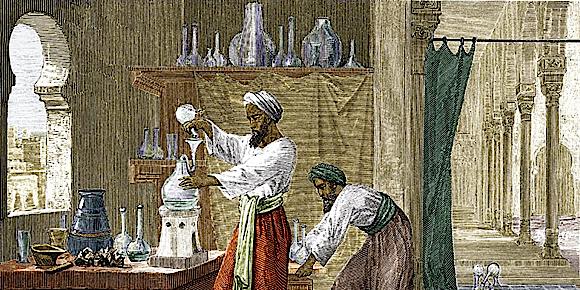
Find the location of a particular element. green curtain is located at coordinates (449, 112).